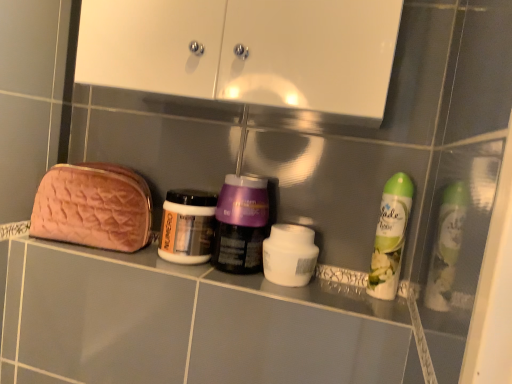
Question: Is purple glossy jar at center, arranged as the second bottle when viewed from the left, to the left or to the right of white matte air freshener at right, acting as the third bottle starting from the left, in the image?

Choices:
 (A) left
 (B) right

Answer: (A)

Question: Which is correct: purple glossy jar at center, which ranks as the second bottle in right-to-left order, is inside white matte air freshener at right, positioned as the 1th bottle in right-to-left order, or outside of it?

Choices:
 (A) inside
 (B) outside

Answer: (B)

Question: Which object is the closest to the white glossy cabinet at upper center?

Choices:
 (A) white matte jar at center
 (B) pink quilted pouch at left
 (C) metallic silver jar at center, which is counted as the first bottle, starting from the left
 (D) white matte air freshener at right, acting as the third bottle starting from the left
 (E) purple glossy jar at center, arranged as the second bottle when viewed from the left

Answer: (E)

Question: Considering the real-world distances, which object is closest to the pink quilted pouch at left?

Choices:
 (A) white glossy cabinet at upper center
 (B) purple glossy jar at center, arranged as the second bottle when viewed from the left
 (C) metallic silver jar at center, which ranks as the 3th bottle in right-to-left order
 (D) white matte air freshener at right, acting as the third bottle starting from the left
 (E) white matte jar at center

Answer: (C)